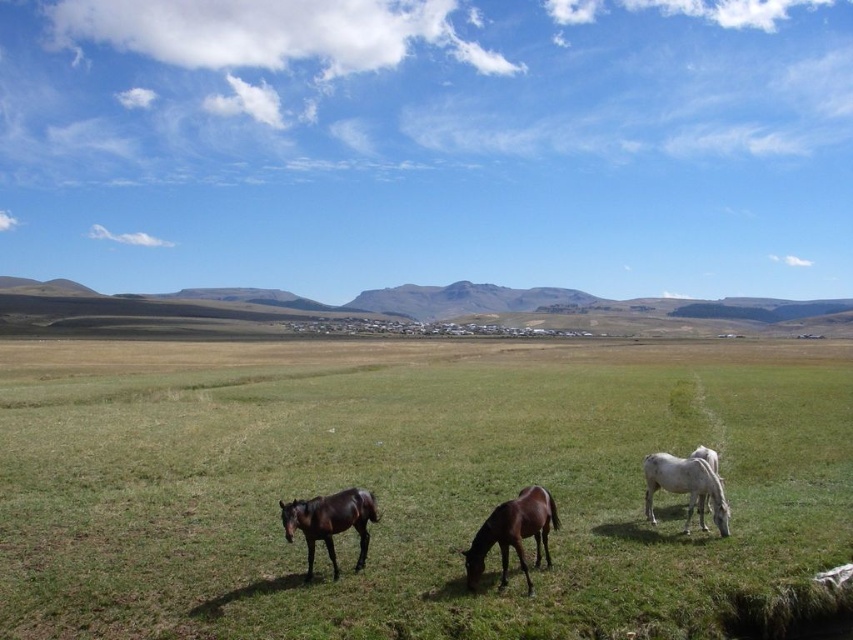
Question: Estimate the real-world distances between objects in this image. Which object is farther from the white glossy horse at right?

Choices:
 (A) shiny brown horse at lower left
 (B) brown glossy horse at center
 (C) green grass pasture at center

Answer: (C)

Question: Is shiny brown horse at lower left smaller than white glossy horse at right?

Choices:
 (A) no
 (B) yes

Answer: (A)

Question: Considering the real-world distances, which object is farthest from the shiny brown horse at lower left?

Choices:
 (A) green grass pasture at center
 (B) white glossy horse at right
 (C) brown glossy horse at center

Answer: (A)

Question: Does shiny brown horse at lower left lie behind white glossy horse at right?

Choices:
 (A) yes
 (B) no

Answer: (B)

Question: Which of the following is the closest to the observer?

Choices:
 (A) (426, 464)
 (B) (668, 484)
 (C) (521, 554)

Answer: (C)

Question: Can you confirm if brown glossy horse at center is positioned above shiny brown horse at lower left?

Choices:
 (A) no
 (B) yes

Answer: (A)